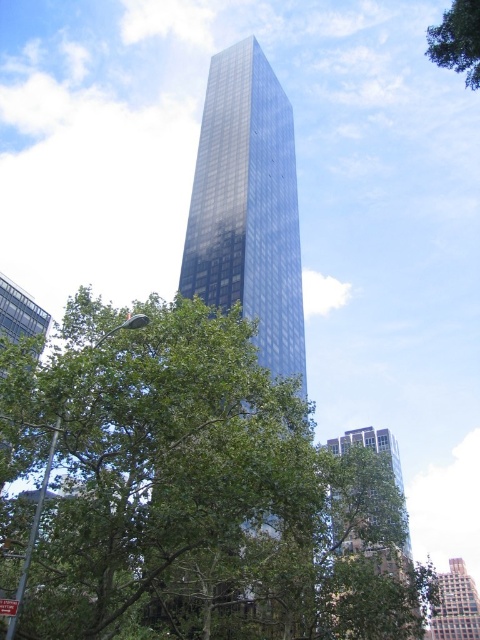
Question: Among these objects, which one is nearest to the camera?

Choices:
 (A) glossy glass tower at center
 (B) green leafy tree at center
 (C) green leafy tree at upper right
 (D) blue glass skyscraper at center

Answer: (B)

Question: Which point is closer to the camera taking this photo?

Choices:
 (A) (396, 564)
 (B) (204, 198)

Answer: (A)

Question: Observing the image, what is the correct spatial positioning of glassy reflective skyscraper at center in reference to blue glass skyscraper at center?

Choices:
 (A) below
 (B) above

Answer: (B)

Question: Can you confirm if glossy glass tower at center is thinner than green leafy tree at upper right?

Choices:
 (A) yes
 (B) no

Answer: (A)

Question: Which of the following is the farthest from the observer?

Choices:
 (A) green leafy tree at center
 (B) glossy glass tower at center
 (C) blue glass skyscraper at center
 (D) green leafy tree at upper right

Answer: (B)

Question: Is green leafy tree at center further to camera compared to blue glass skyscraper at center?

Choices:
 (A) yes
 (B) no

Answer: (B)